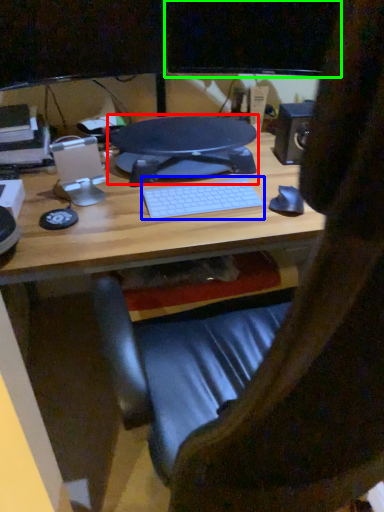
Question: Based on their relative distances, which object is nearer to desktop (highlighted by a red box)? Choose from computer keyboard (highlighted by a blue box) and computer monitor (highlighted by a green box).

Choices:
 (A) computer keyboard
 (B) computer monitor

Answer: (A)